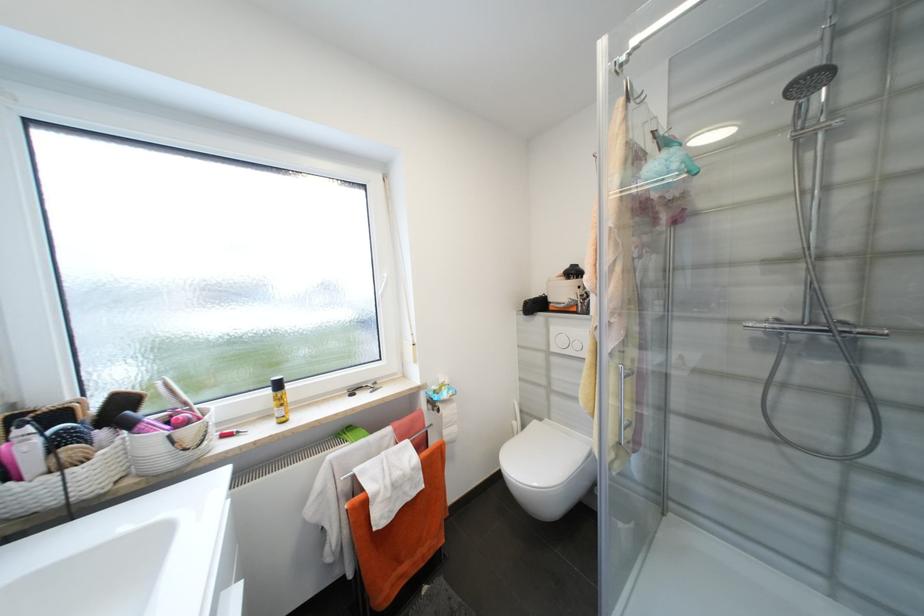
The height and width of the screenshot is (616, 924). What do you see at coordinates (850, 126) in the screenshot?
I see `a shower control knob` at bounding box center [850, 126].